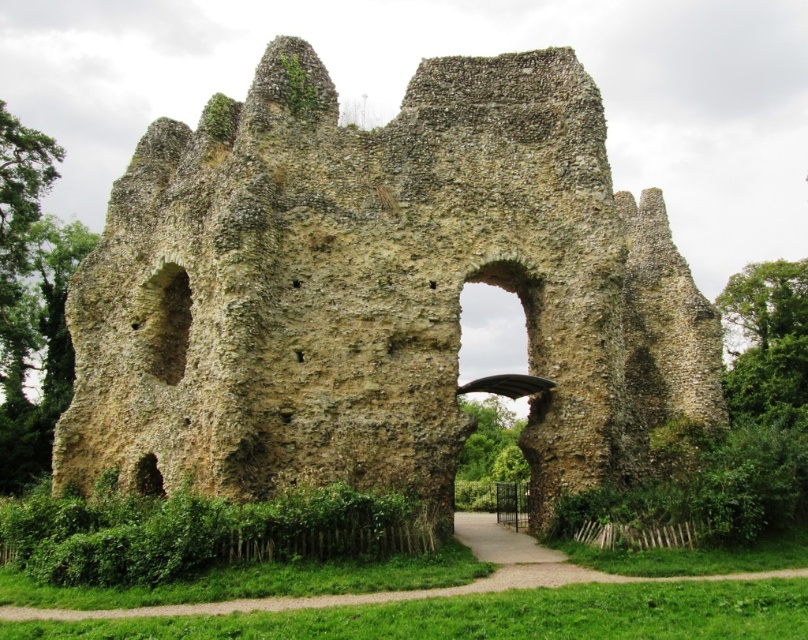
Question: Is rustic stone ruins at center positioned in front of stone archway at center?

Choices:
 (A) no
 (B) yes

Answer: (B)

Question: Is rustic stone ruins at center wider than stone archway at center?

Choices:
 (A) no
 (B) yes

Answer: (B)

Question: Which point appears closest to the camera in this image?

Choices:
 (A) (499, 225)
 (B) (529, 305)

Answer: (A)

Question: Which of the following is the closest to the observer?

Choices:
 (A) stone archway at center
 (B) rustic stone ruins at center

Answer: (B)

Question: Considering the relative positions of rustic stone ruins at center and stone archway at center in the image provided, where is rustic stone ruins at center located with respect to stone archway at center?

Choices:
 (A) below
 (B) above

Answer: (B)